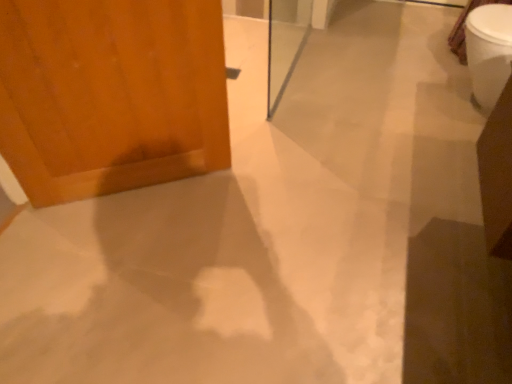
Identify the location of transparent glass screen door at center. (285, 44).

Describe the element at coordinates (111, 94) in the screenshot. I see `wooden door at left` at that location.

Measure the distance between point (x=479, y=100) and camera.

Point (x=479, y=100) and camera are 6.99 feet apart.

Identify the location of transparent glass screen door at center. The width and height of the screenshot is (512, 384). (285, 44).

From the image's perspective, is white glossy toilet bowl at upper right below wooden door at left?

No.

Is white glossy toilet bowl at upper right further to camera compared to wooden door at left?

Yes, white glossy toilet bowl at upper right is further from the camera.

Could you tell me if white glossy toilet bowl at upper right is facing wooden door at left?

No, white glossy toilet bowl at upper right is not aimed at wooden door at left.

Can you confirm if transparent glass screen door at center is smaller than wooden door at left?

Yes.

Can wooden door at left be found inside transparent glass screen door at center?

That's incorrect, wooden door at left is not inside transparent glass screen door at center.

Does transparent glass screen door at center have a greater width compared to wooden door at left?

No, transparent glass screen door at center is not wider than wooden door at left.

Considering the positions of points (286, 70) and (153, 127), is point (286, 70) closer to camera compared to point (153, 127)?

No.

Is wooden door at left in contact with transparent glass screen door at center?

They are not placed beside each other.

Which of these two, wooden door at left or transparent glass screen door at center, is wider?

With larger width is wooden door at left.

Is point (20, 98) more distant than point (271, 13)?

No, it is not.

From the image's perspective, is transparent glass screen door at center beneath white glossy toilet bowl at upper right?

Actually, transparent glass screen door at center appears above white glossy toilet bowl at upper right in the image.

Relative to white glossy toilet bowl at upper right, is transparent glass screen door at center in front or behind?

Clearly, transparent glass screen door at center is in front of white glossy toilet bowl at upper right.

From a real-world perspective, is transparent glass screen door at center positioned over white glossy toilet bowl at upper right based on gravity?

Correct, in the physical world, transparent glass screen door at center is higher than white glossy toilet bowl at upper right.

Is point (268, 115) closer to viewer compared to point (504, 9)?

No, it is not.

From the picture: Is wooden door at left in contact with white glossy toilet bowl at upper right?

There is a gap between wooden door at left and white glossy toilet bowl at upper right.

Between wooden door at left and white glossy toilet bowl at upper right, which one has less height?

white glossy toilet bowl at upper right.

Can you confirm if wooden door at left is positioned to the left of white glossy toilet bowl at upper right?

Yes.

Is wooden door at left oriented away from white glossy toilet bowl at upper right?

No, wooden door at left is not facing the opposite direction of white glossy toilet bowl at upper right.

Does white glossy toilet bowl at upper right turn towards transparent glass screen door at center?

Yes.

Which of these two, white glossy toilet bowl at upper right or transparent glass screen door at center, is bigger?

With larger size is white glossy toilet bowl at upper right.

Which object is closer to the camera, white glossy toilet bowl at upper right or transparent glass screen door at center?

transparent glass screen door at center is closer to the camera.

Considering the positions of objects white glossy toilet bowl at upper right and transparent glass screen door at center in the image provided, who is more to the right, white glossy toilet bowl at upper right or transparent glass screen door at center?

white glossy toilet bowl at upper right is more to the right.

This screenshot has width=512, height=384. What are the coordinates of `door below the white glossy toilet bowl at upper right (from the image's perspective)` in the screenshot? It's located at (111, 94).

The width and height of the screenshot is (512, 384). I want to click on door in front of the transparent glass screen door at center, so click(111, 94).

When comparing their distances from transparent glass screen door at center, does white glossy toilet bowl at upper right or wooden door at left seem closer?

Based on the image, wooden door at left appears to be nearer to transparent glass screen door at center.

From the image, which object appears to be nearer to wooden door at left, transparent glass screen door at center or white glossy toilet bowl at upper right?

transparent glass screen door at center lies closer to wooden door at left than the other object.

Looking at the image, which one is located further to transparent glass screen door at center, wooden door at left or white glossy toilet bowl at upper right?

The object further to transparent glass screen door at center is white glossy toilet bowl at upper right.

Considering their positions, is transparent glass screen door at center positioned further to white glossy toilet bowl at upper right than wooden door at left?

Among the two, wooden door at left is located further to white glossy toilet bowl at upper right.

Looking at the image, which one is located further to wooden door at left, white glossy toilet bowl at upper right or transparent glass screen door at center?

white glossy toilet bowl at upper right is positioned further to the anchor wooden door at left.

Which object lies nearer to the anchor point white glossy toilet bowl at upper right, wooden door at left or transparent glass screen door at center?

Among the two, transparent glass screen door at center is located nearer to white glossy toilet bowl at upper right.

The width and height of the screenshot is (512, 384). I want to click on screen door located between wooden door at left and white glossy toilet bowl at upper right in the left-right direction, so click(x=285, y=44).